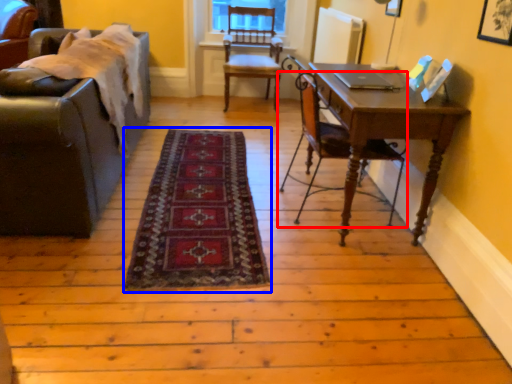
Question: Which point is further to the camera, chair (highlighted by a red box) or mat (highlighted by a blue box)?

Choices:
 (A) chair
 (B) mat

Answer: (A)